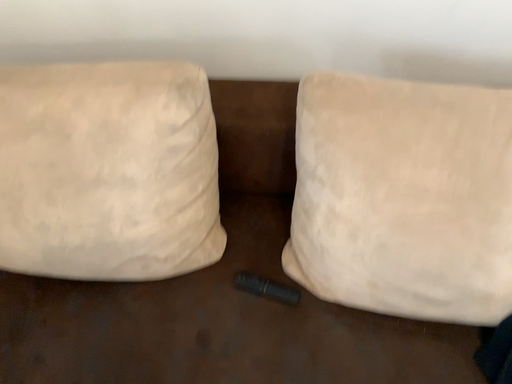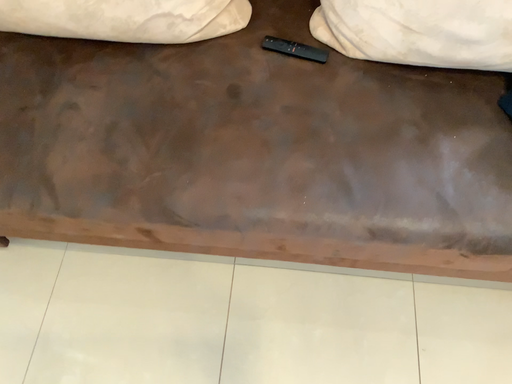
Question: Which way did the camera rotate in the video?

Choices:
 (A) rotated downward
 (B) rotated upward

Answer: (A)